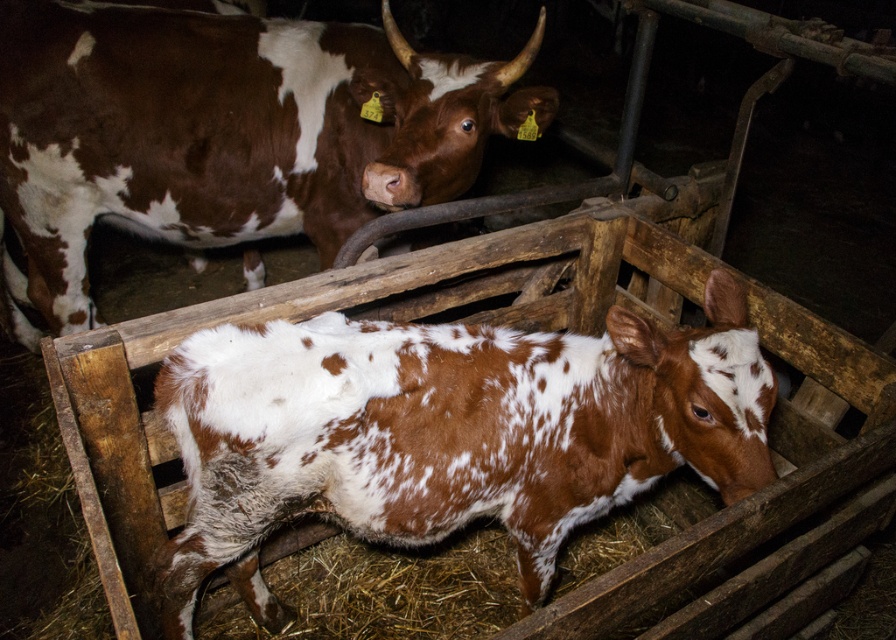
Question: Which point appears closest to the camera in this image?

Choices:
 (A) (392, 54)
 (B) (207, 528)

Answer: (B)

Question: Which point appears closest to the camera in this image?

Choices:
 (A) (342, 209)
 (B) (549, 460)

Answer: (B)

Question: Does brown speckled fur at center come in front of brown speckled hide at center?

Choices:
 (A) yes
 (B) no

Answer: (A)

Question: Among these objects, which one is farthest from the camera?

Choices:
 (A) brown speckled hide at center
 (B) brown speckled fur at center

Answer: (A)

Question: In this image, where is brown speckled fur at center located relative to brown speckled hide at center?

Choices:
 (A) above
 (B) below

Answer: (B)

Question: Is brown speckled fur at center to the left of brown speckled hide at center from the viewer's perspective?

Choices:
 (A) yes
 (B) no

Answer: (B)